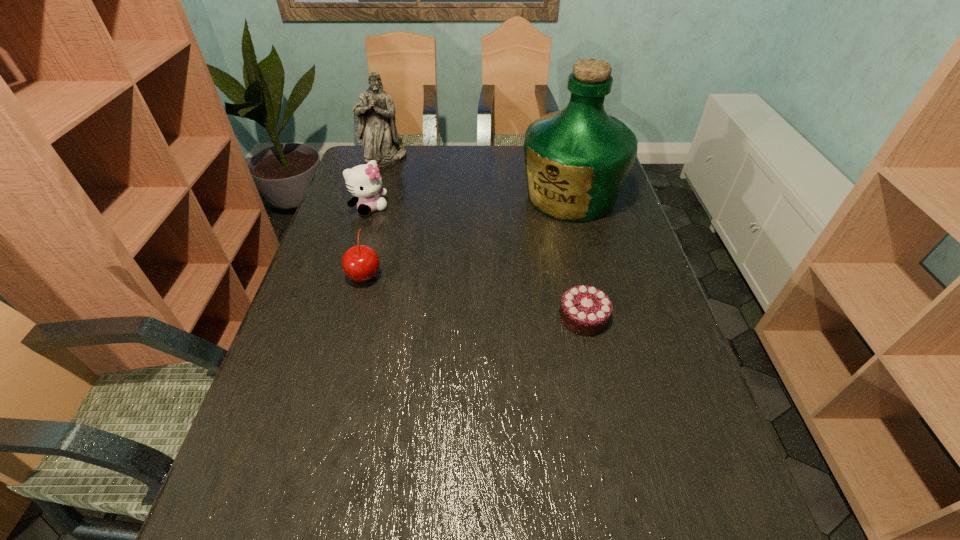
At what (x,y) coordinates should I click in order to perform the action: click on blank space at the left edge of the desktop. Please return your answer as a coordinate pair (x, y). The height and width of the screenshot is (540, 960). Looking at the image, I should click on (297, 361).

Image resolution: width=960 pixels, height=540 pixels. I want to click on free region at the right edge, so click(x=609, y=274).

This screenshot has height=540, width=960. In order to click on vacant point at the near left corner in this screenshot , I will do `click(258, 473)`.

Identify the location of vacant space in between the fourth tallest object and the liquor. (468, 236).

Where is `free spot between the nearest object and the kitten`? The image size is (960, 540). free spot between the nearest object and the kitten is located at coordinates (476, 263).

This screenshot has width=960, height=540. What are the coordinates of `vacant space that's between the shortest object and the liquor` in the screenshot? It's located at (577, 257).

The width and height of the screenshot is (960, 540). Find the location of `blank region between the tallest object and the third tallest object`. blank region between the tallest object and the third tallest object is located at coordinates (470, 202).

This screenshot has width=960, height=540. I want to click on vacant space that is in between the figurine and the liquor, so click(478, 177).

Locate an element on the screen. empty space between the fourth farthest object and the liquor is located at coordinates (468, 236).

Locate an element on the screen. free spot between the shortest object and the third tallest object is located at coordinates (476, 263).